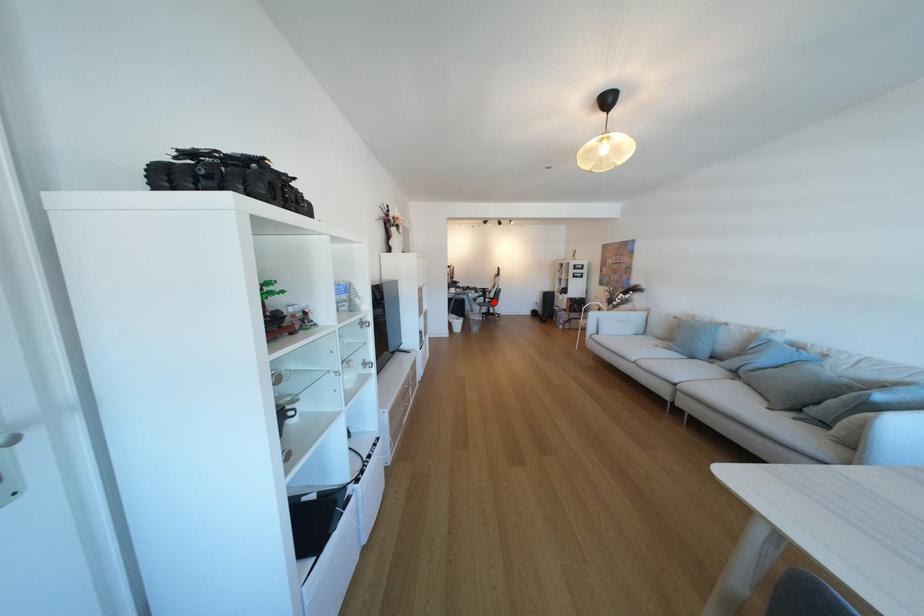
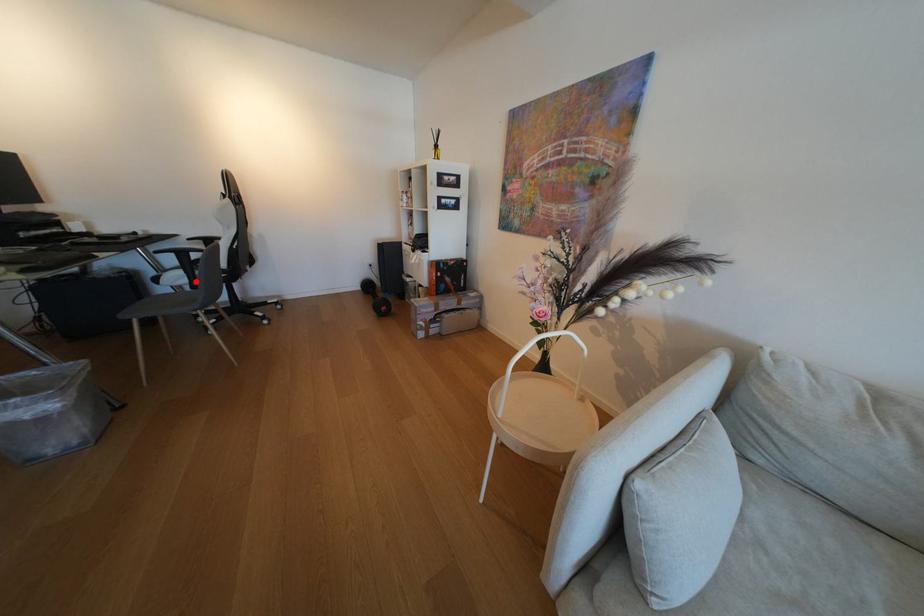
I am providing you with two images of the same scene from different viewpoints. A red point is marked on the first image and another point is marked on the second image. Does the point marked in image1 correspond to the same location as the one in image2?

Yes